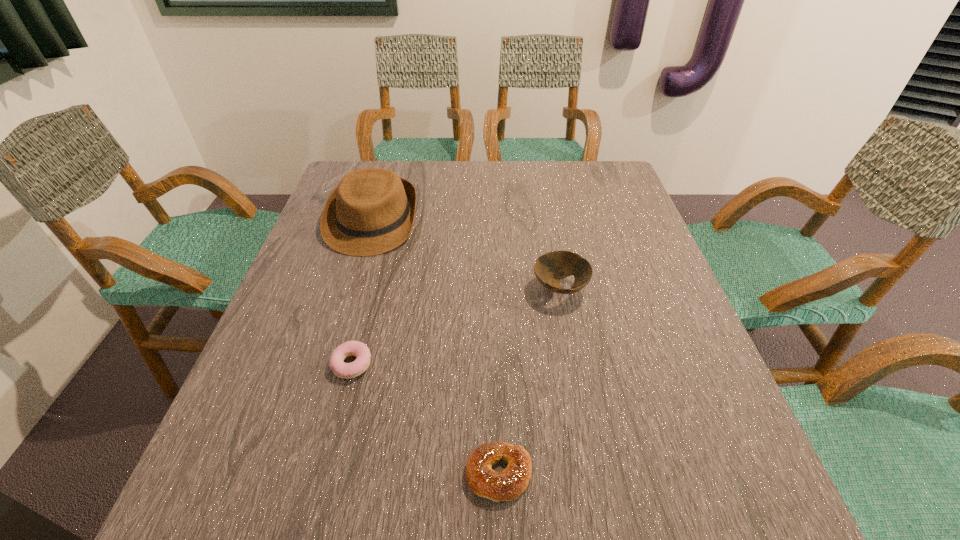
Locate an element on the screen. vacant area that lies between the rightmost object and the second object from right to left is located at coordinates (529, 382).

Image resolution: width=960 pixels, height=540 pixels. I want to click on object that is the second nearest to the third farthest object, so click(371, 211).

Where is `object identified as the closest to the doughnut`? This screenshot has width=960, height=540. object identified as the closest to the doughnut is located at coordinates (507, 485).

Find the location of a particular element. vacant area that satisfies the following two spatial constraints: 1. on the back side of the bowl; 2. on the left side of the second nearest object is located at coordinates (372, 289).

Find the location of a particular element. This screenshot has width=960, height=540. vacant space that satisfies the following two spatial constraints: 1. on the front-facing side of the farthest object; 2. on the left side of the bagel is located at coordinates (296, 474).

Where is `free point that satisfies the following two spatial constraints: 1. on the front-facing side of the bagel; 2. on the left side of the farthest object`? free point that satisfies the following two spatial constraints: 1. on the front-facing side of the bagel; 2. on the left side of the farthest object is located at coordinates (296, 474).

Image resolution: width=960 pixels, height=540 pixels. Identify the location of free space that satisfies the following two spatial constraints: 1. on the front-facing side of the fedora; 2. on the right side of the doughnut. (329, 364).

The height and width of the screenshot is (540, 960). I want to click on free space that satisfies the following two spatial constraints: 1. on the back side of the nearest object; 2. on the left side of the bowl, so click(493, 289).

Locate an element on the screen. Image resolution: width=960 pixels, height=540 pixels. free space that satisfies the following two spatial constraints: 1. on the front-facing side of the doughnut; 2. on the right side of the farthest object is located at coordinates (329, 364).